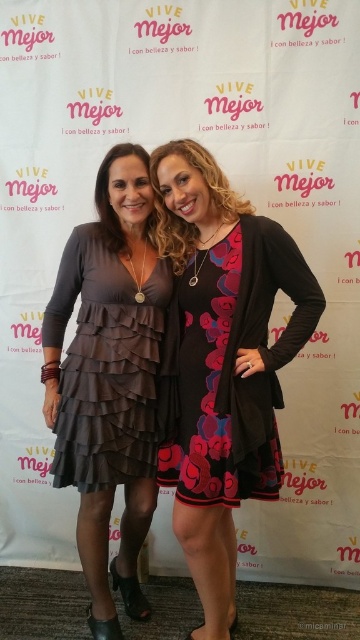
Who is positioned more to the right, floral dress at center or floral-patterned dress at center?

Positioned to the right is floral dress at center.

Does floral dress at center appear on the right side of floral-patterned dress at center?

Correct, you'll find floral dress at center to the right of floral-patterned dress at center.

Between point (186, 493) and point (225, 276), which one is positioned behind?

Positioned behind is point (186, 493).

The height and width of the screenshot is (640, 360). Find the location of `floral dress at center`. floral dress at center is located at coordinates (223, 362).

Who is higher up, floral dress at center or matte gray dress at center?

matte gray dress at center is above.

Does floral dress at center have a lesser height compared to matte gray dress at center?

Indeed, floral dress at center has a lesser height compared to matte gray dress at center.

This screenshot has height=640, width=360. I want to click on floral dress at center, so pos(223,362).

Between matte gray dress at center and floral-patterned dress at center, which one has less height?

floral-patterned dress at center is shorter.

Measure the distance from matte gray dress at center to floral-patterned dress at center.

A distance of 26.87 centimeters exists between matte gray dress at center and floral-patterned dress at center.

The width and height of the screenshot is (360, 640). What do you see at coordinates (109, 378) in the screenshot?
I see `matte gray dress at center` at bounding box center [109, 378].

In order to click on matte gray dress at center in this screenshot , I will do `click(109, 378)`.